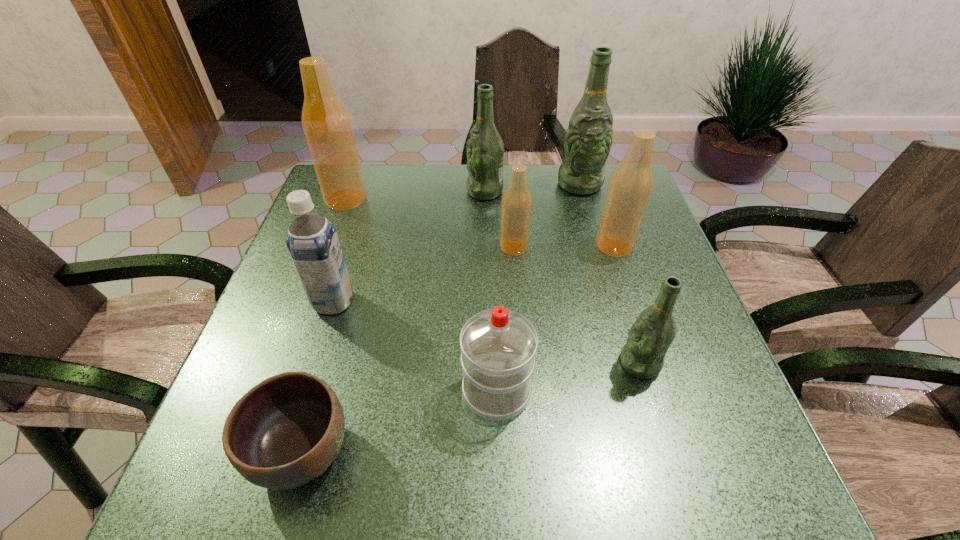
Identify the location of object that is at the far left corner. (326, 123).

The width and height of the screenshot is (960, 540). I want to click on object present at the near left corner, so click(x=284, y=432).

Find the location of `object that is at the far right corner`. object that is at the far right corner is located at coordinates (588, 139).

Where is `free spot at the far edge of the desktop`? This screenshot has width=960, height=540. free spot at the far edge of the desktop is located at coordinates (394, 188).

You are a GUI agent. You are given a task and a screenshot of the screen. Output one action in this format:
    pyautogui.click(x=<x>, y=<y>)
    Task: Click on the free region at the near edge
    Image resolution: width=960 pixels, height=540 pixels.
    Given the screenshot: What is the action you would take?
    pyautogui.click(x=490, y=463)

Locate an element on the screen. The image size is (960, 540). vacant area at the left edge is located at coordinates (334, 322).

At what (x,y) coordinates should I click in order to perform the action: click on blank space at the right edge of the desktop. Please return your answer as a coordinate pair (x, y). Looking at the image, I should click on (676, 323).

Find the location of `vacant space at the near left corner of the desktop`. vacant space at the near left corner of the desktop is located at coordinates (224, 466).

Find the location of a particular element. Image resolution: width=960 pixels, height=540 pixels. free spot between the second tan beer bottle from left to right and the soya milk is located at coordinates (423, 274).

This screenshot has height=540, width=960. What are the coordinates of `unoccupied area between the fourth nearest object and the water bottle` in the screenshot? It's located at (415, 346).